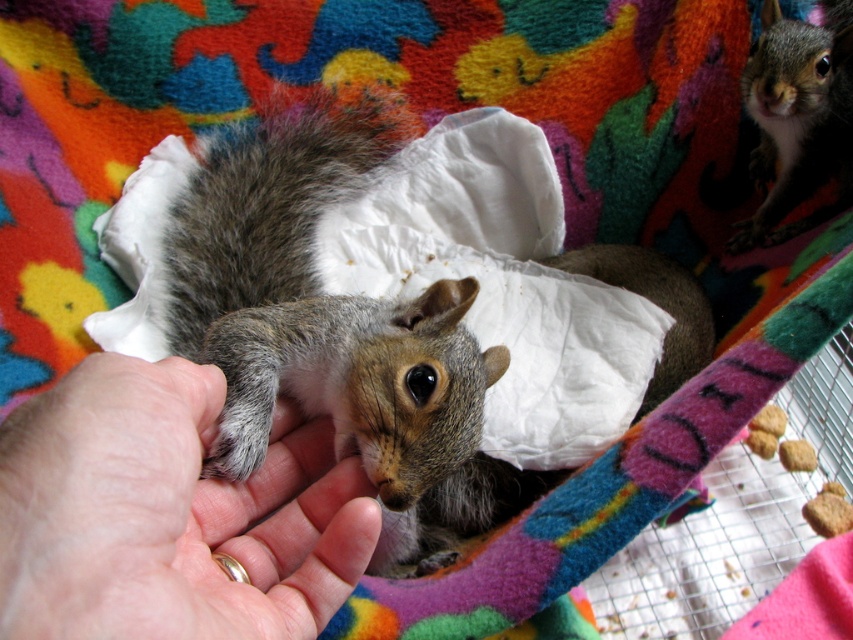
Between point (306, 113) and point (99, 468), which one is positioned behind?

Positioned behind is point (306, 113).

Looking at this image, how much distance is there between gray fur squirrel at center and smooth skin hand at center?

6.95 inches

At what (x,y) coordinates should I click in order to perform the action: click on gray fur squirrel at center. Please return your answer as a coordinate pair (x, y). The height and width of the screenshot is (640, 853). Looking at the image, I should click on (332, 326).

Can you confirm if smooth skin hand at center is positioned above gray fur squirrel at upper right?

Incorrect, smooth skin hand at center is not positioned above gray fur squirrel at upper right.

Is point (152, 420) positioned in front of point (773, 65)?

That is True.

I want to click on smooth skin hand at center, so click(169, 513).

Which is below, gray fur squirrel at center or gray fur squirrel at upper right?

gray fur squirrel at center is lower down.

Is gray fur squirrel at center wider than gray fur squirrel at upper right?

Correct, the width of gray fur squirrel at center exceeds that of gray fur squirrel at upper right.

Is point (276, 365) in front of point (824, 22)?

Yes, point (276, 365) is closer to viewer.

Locate an element on the screen. Image resolution: width=853 pixels, height=640 pixels. gray fur squirrel at center is located at coordinates (332, 326).